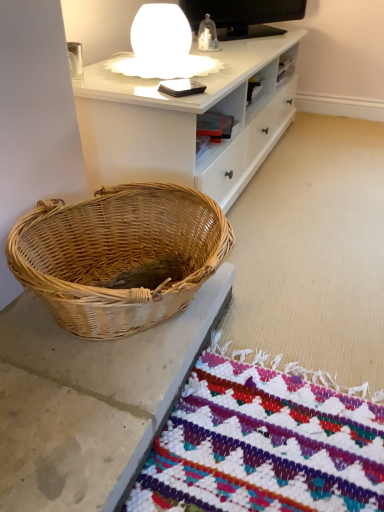
Question: Is woven natural basket at lower left in front of or behind white matte table lamp at upper center in the image?

Choices:
 (A) front
 (B) behind

Answer: (A)

Question: Is woven natural basket at lower left wider or thinner than white matte table lamp at upper center?

Choices:
 (A) thin
 (B) wide

Answer: (B)

Question: From a real-world perspective, is woven natural basket at lower left positioned above or below white matte table lamp at upper center?

Choices:
 (A) below
 (B) above

Answer: (A)

Question: In the image, is white matte table lamp at upper center on the left side or the right side of woven natural basket at lower left?

Choices:
 (A) left
 (B) right

Answer: (B)

Question: Is point (198, 55) closer or farther from the camera than point (71, 249)?

Choices:
 (A) farther
 (B) closer

Answer: (A)

Question: From a real-world perspective, relative to woven natural basket at lower left, is white matte table lamp at upper center vertically above or below?

Choices:
 (A) below
 (B) above

Answer: (B)

Question: In terms of size, does white matte table lamp at upper center appear bigger or smaller than woven natural basket at lower left?

Choices:
 (A) big
 (B) small

Answer: (B)